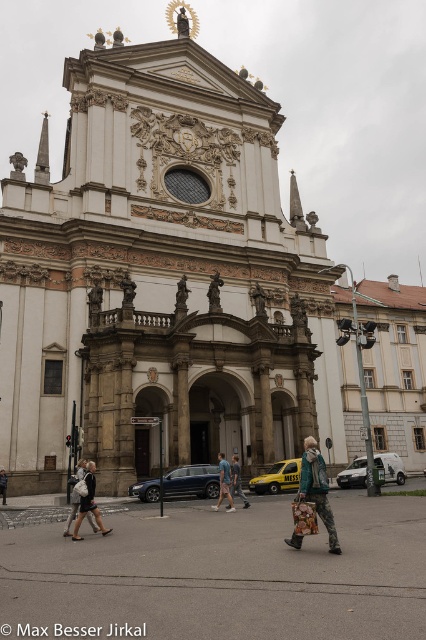
Question: Which point is farther to the camera?

Choices:
 (A) (80, 506)
 (B) (242, 492)
 (C) (167, 100)

Answer: (C)

Question: Which of the following is the farthest from the observer?

Choices:
 (A) gray asphalt at center
 (B) dark blue jeans at lower left
 (C) white stone church at center

Answer: (C)

Question: Observing the image, what is the correct spatial positioning of white stone church at center in reference to dark blue jeans at lower left?

Choices:
 (A) right
 (B) left

Answer: (A)

Question: Which object is the closest to the denim jacket at center?

Choices:
 (A) gray asphalt at center
 (B) black leather jacket at lower left
 (C) white stone church at center
 (D) denim shorts at center

Answer: (D)

Question: Is gray asphalt at center to the left of black leather jacket at lower left from the viewer's perspective?

Choices:
 (A) no
 (B) yes

Answer: (A)

Question: Can you confirm if denim shorts at center is bigger than dark blue jeans at lower left?

Choices:
 (A) yes
 (B) no

Answer: (A)